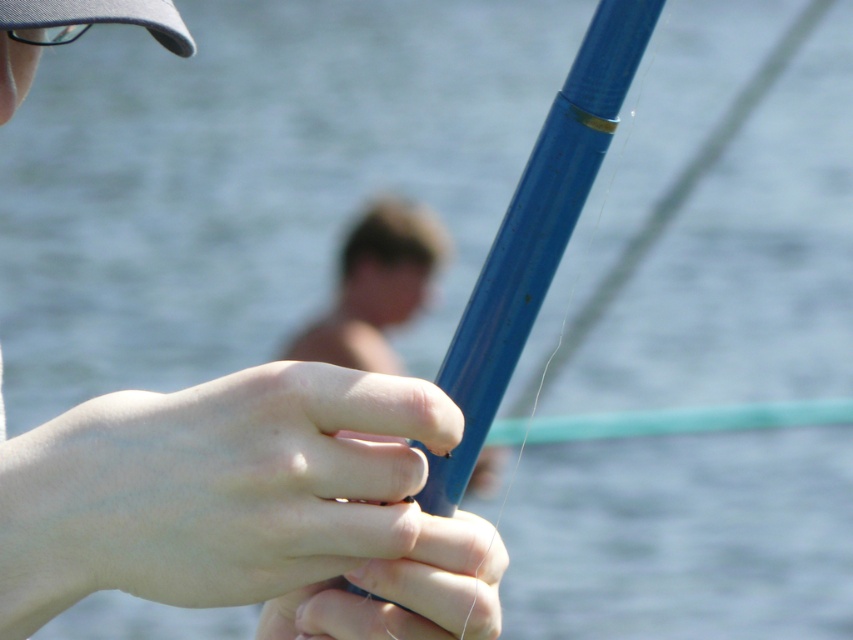
Does smooth skin hand at center come behind matte gray baseball cap at upper left?

No, smooth skin hand at center is closer to the viewer.

Is point (291, 538) behind point (36, 26)?

No.

Who is more forward, (57, 534) or (16, 10)?

Point (57, 534) is in front.

This screenshot has height=640, width=853. Identify the location of smooth skin hand at center. (258, 484).

Is smooth skin hand at center closer to the viewer compared to matte blue pole at center?

Yes, smooth skin hand at center is in front of matte blue pole at center.

Find the location of `smooth skin hand at center`. smooth skin hand at center is located at coordinates (258, 484).

Identify the location of smooth skin hand at center. The height and width of the screenshot is (640, 853). (258, 484).

This screenshot has height=640, width=853. What do you see at coordinates (102, 17) in the screenshot?
I see `matte gray baseball cap at upper left` at bounding box center [102, 17].

Describe the element at coordinates (102, 17) in the screenshot. The height and width of the screenshot is (640, 853). I see `matte gray baseball cap at upper left` at that location.

Where is `matte gray baseball cap at upper left`? The width and height of the screenshot is (853, 640). matte gray baseball cap at upper left is located at coordinates tap(102, 17).